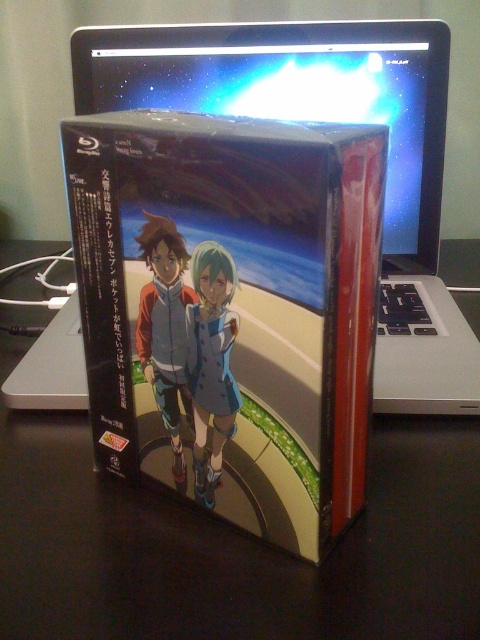
Question: Which point is closer to the camera taking this photo?

Choices:
 (A) (386, 176)
 (B) (24, 413)

Answer: (A)

Question: Does black matte table at center have a lesser width compared to silver metallic laptop at upper center?

Choices:
 (A) no
 (B) yes

Answer: (A)

Question: Which object is farther from the camera taking this photo?

Choices:
 (A) black matte table at center
 (B) silver metallic laptop at upper center

Answer: (B)

Question: Does black matte table at center appear over silver metallic laptop at upper center?

Choices:
 (A) yes
 (B) no

Answer: (B)

Question: Can you confirm if black matte table at center is positioned above silver metallic laptop at upper center?

Choices:
 (A) no
 (B) yes

Answer: (A)